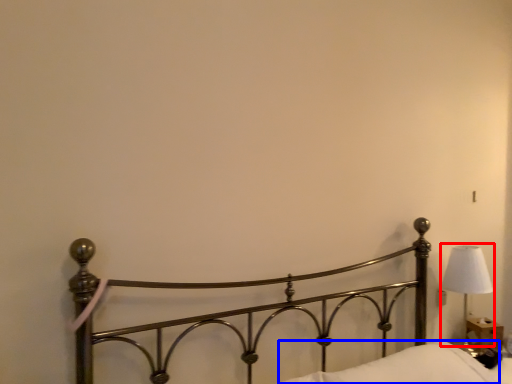
Question: Which object is closer to the camera taking this photo, lamp (highlighted by a red box) or pillow (highlighted by a blue box)?

Choices:
 (A) lamp
 (B) pillow

Answer: (B)